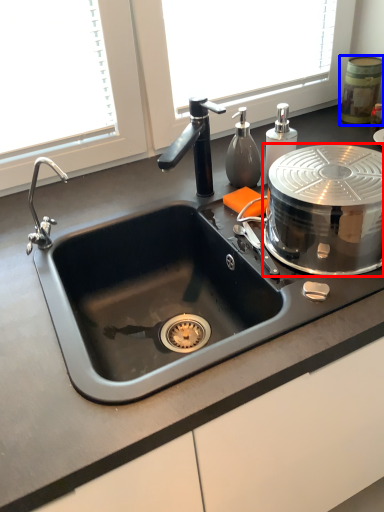
Question: Which point is further to the camera, appliance (highlighted by a red box) or appliance (highlighted by a blue box)?

Choices:
 (A) appliance
 (B) appliance

Answer: (B)